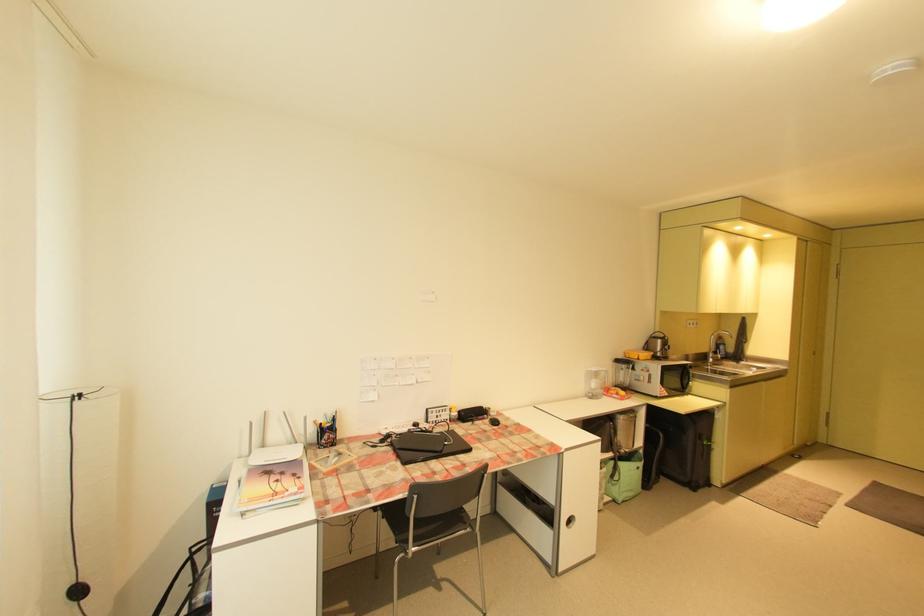
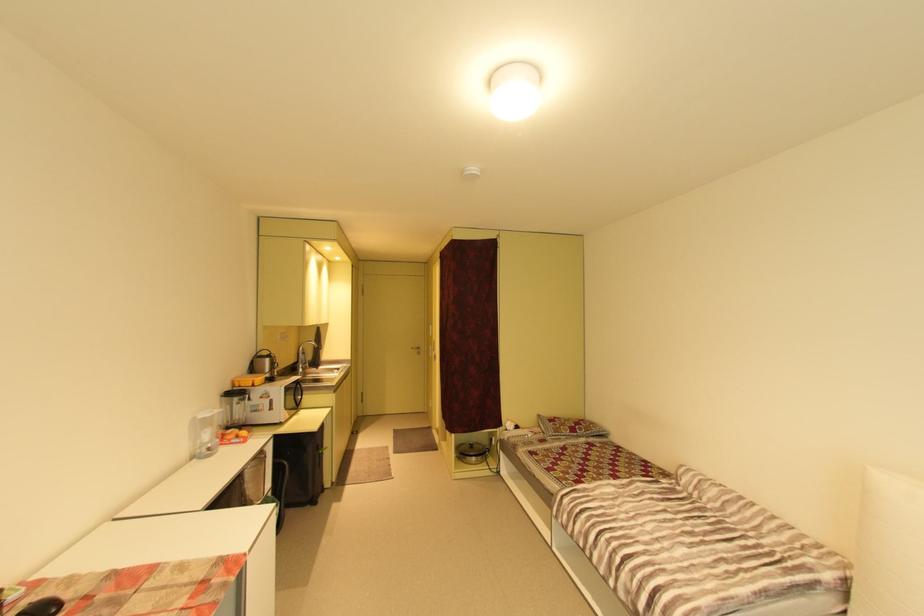
Find the pixel in the second image that matches (x=736, y=350) in the first image.

(317, 358)